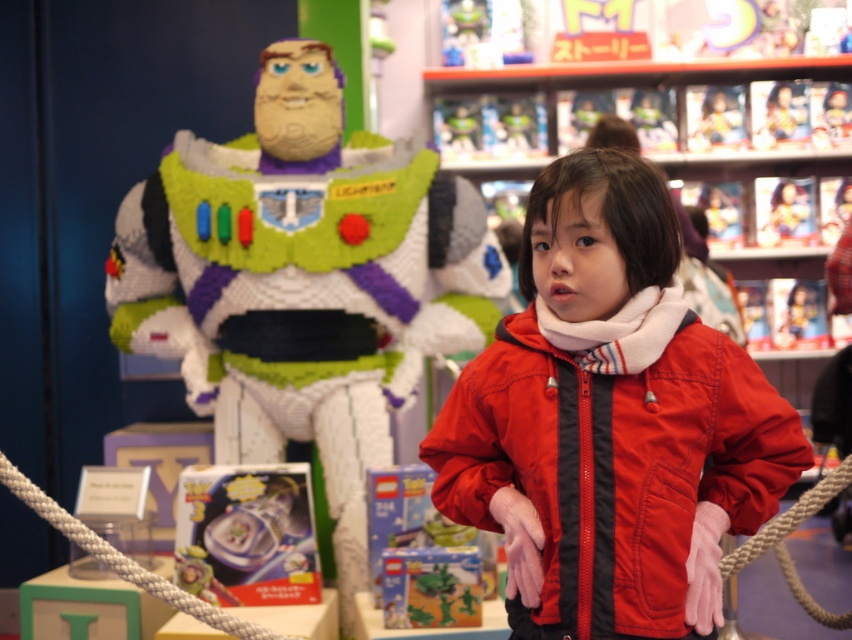
Is point (643, 360) less distant than point (294, 48)?

Yes.

Does red matte jacket at center come behind white lego figure at center?

That is False.

Which is behind, point (666, 529) or point (217, 296)?

Point (217, 296)

Identify the location of red matte jacket at center. The width and height of the screenshot is (852, 640). click(x=609, y=424).